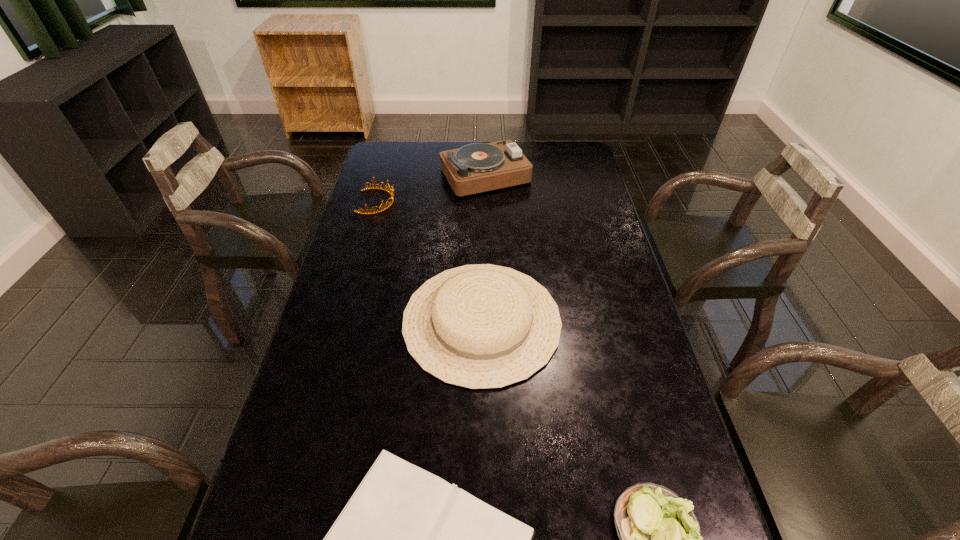
This screenshot has height=540, width=960. I want to click on vacant space at the right edge, so click(637, 308).

You are a GUI agent. You are given a task and a screenshot of the screen. Output one action in this format:
    pyautogui.click(x=<x>, y=<y>)
    Task: Click on the free space at the far left corner
    
    Given the screenshot: What is the action you would take?
    pyautogui.click(x=391, y=144)

Locate an element on the screen. free space at the far right corner of the desktop is located at coordinates (562, 150).

You are a GUI agent. You are given a task and a screenshot of the screen. Output one action in this format:
    pyautogui.click(x=<x>, y=<y>)
    Task: Click on the free space between the sunhat and the record player
    The width and height of the screenshot is (960, 540).
    Given the screenshot: What is the action you would take?
    pyautogui.click(x=484, y=248)

Identify which object is located as the third nearest to the tiara. Please provide its 2D coordinates. Your answer should be formatted as a tuple, i.e. [(x, y)], where the tuple contains the x and y coordinates of a point satisfying the conditions above.

[(407, 539)]

Identify which object is the fourth nearest to the leftmost object. Please provide its 2D coordinates. Your answer should be formatted as a tuple, i.e. [(x, y)], where the tuple contains the x and y coordinates of a point satisfying the conditions above.

[(660, 538)]

Locate an element on the screen. The image size is (960, 540). free space that satisfies the following two spatial constraints: 1. on the front-facing side of the leftmost object; 2. on the back side of the third farthest object is located at coordinates (344, 321).

This screenshot has width=960, height=540. Find the location of `free space in the image that satisfies the following two spatial constraints: 1. on the front-facing side of the sunhat; 2. on the right side of the tiara`. free space in the image that satisfies the following two spatial constraints: 1. on the front-facing side of the sunhat; 2. on the right side of the tiara is located at coordinates (344, 321).

Where is `free space that satisfies the following two spatial constraints: 1. on the front-facing side of the sunhat; 2. on the left side of the tiara`? This screenshot has height=540, width=960. free space that satisfies the following two spatial constraints: 1. on the front-facing side of the sunhat; 2. on the left side of the tiara is located at coordinates (344, 321).

Identify the location of free space that satisfies the following two spatial constraints: 1. on the front-facing side of the sunhat; 2. on the left side of the leftmost object. The height and width of the screenshot is (540, 960). (344, 321).